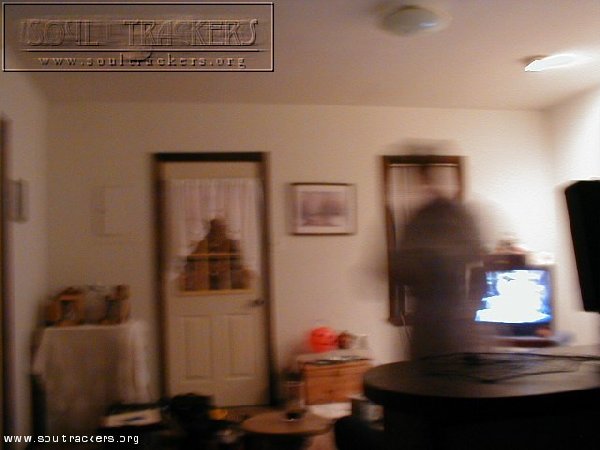
Where is `panel`? This screenshot has height=450, width=600. panel is located at coordinates tap(192, 358), tap(242, 359).